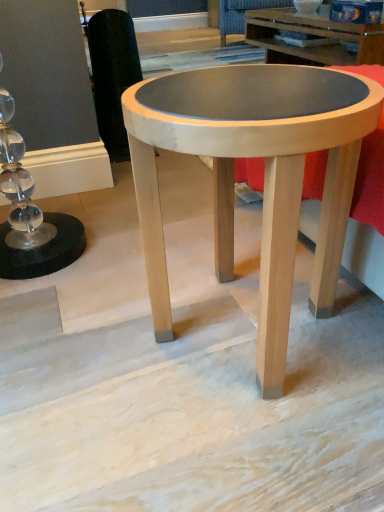
Question: Is matte wood coffee table at center aimed at velvet dark blue swivel chair at upper center, the 1th swivel chair in the right-to-left sequence?

Choices:
 (A) yes
 (B) no

Answer: (B)

Question: Is matte wood coffee table at center outside of velvet dark blue swivel chair at upper center, acting as the second swivel chair starting from the bottom?

Choices:
 (A) yes
 (B) no

Answer: (A)

Question: Does matte wood coffee table at center have a larger size compared to velvet dark blue swivel chair at upper center, which ranks as the second swivel chair in left-to-right order?

Choices:
 (A) no
 (B) yes

Answer: (A)

Question: Does matte wood coffee table at center contain velvet dark blue swivel chair at upper center, which appears as the second swivel chair when viewed from the front?

Choices:
 (A) yes
 (B) no

Answer: (B)

Question: From the image's perspective, is matte wood coffee table at center above velvet dark blue swivel chair at upper center, which ranks as the second swivel chair in left-to-right order?

Choices:
 (A) no
 (B) yes

Answer: (A)

Question: Considering the positions of black fabric swivel chair at left, the 2th swivel chair when ordered from top to bottom, and matte wood coffee table at center in the image, is black fabric swivel chair at left, the 2th swivel chair when ordered from top to bottom, wider or thinner than matte wood coffee table at center?

Choices:
 (A) wide
 (B) thin

Answer: (B)

Question: Is black fabric swivel chair at left, placed as the first swivel chair when sorted from front to back, bigger or smaller than matte wood coffee table at center?

Choices:
 (A) small
 (B) big

Answer: (A)

Question: Considering the positions of black fabric swivel chair at left, the 2th swivel chair in the back-to-front sequence, and matte wood coffee table at center in the image, is black fabric swivel chair at left, the 2th swivel chair in the back-to-front sequence, taller or shorter than matte wood coffee table at center?

Choices:
 (A) short
 (B) tall

Answer: (B)

Question: From a real-world perspective, relative to matte wood coffee table at center, is black fabric swivel chair at left, arranged as the 1th swivel chair when ordered from the bottom, vertically above or below?

Choices:
 (A) above
 (B) below

Answer: (A)

Question: Is point (160, 102) closer or farther from the camera than point (220, 5)?

Choices:
 (A) farther
 (B) closer

Answer: (B)

Question: Is matte wood coffee table at center taller or shorter than velvet dark blue swivel chair at upper center, the first swivel chair in the back-to-front sequence?

Choices:
 (A) short
 (B) tall

Answer: (B)

Question: Looking at their shapes, would you say matte wood coffee table at center is wider or thinner than velvet dark blue swivel chair at upper center, the first swivel chair in the back-to-front sequence?

Choices:
 (A) wide
 (B) thin

Answer: (B)

Question: Is matte wood coffee table at center bigger or smaller than velvet dark blue swivel chair at upper center, the first swivel chair in the back-to-front sequence?

Choices:
 (A) big
 (B) small

Answer: (B)

Question: Is velvet dark blue swivel chair at upper center, the 1th swivel chair in the right-to-left sequence, inside or outside of matte wood coffee table at center?

Choices:
 (A) inside
 (B) outside

Answer: (B)

Question: Considering the positions of velvet dark blue swivel chair at upper center, the 1th swivel chair when ordered from top to bottom, and matte wood coffee table at center in the image, is velvet dark blue swivel chair at upper center, the 1th swivel chair when ordered from top to bottom, wider or thinner than matte wood coffee table at center?

Choices:
 (A) wide
 (B) thin

Answer: (A)